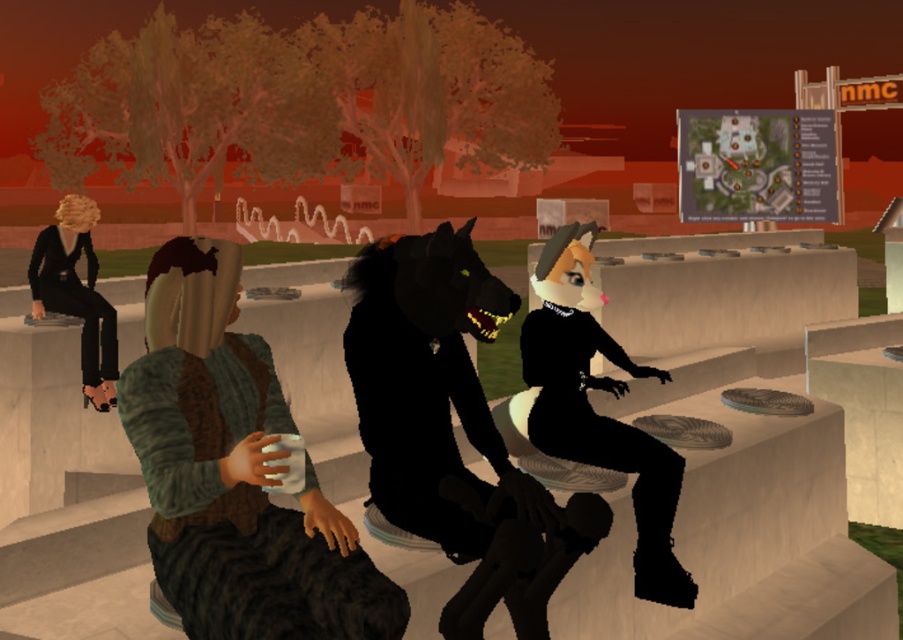
Is point (424, 244) closer to viewer compared to point (585, 321)?

Yes, it is.

Image resolution: width=903 pixels, height=640 pixels. In order to click on black matte wolf at center in this screenshot , I will do `click(430, 385)`.

Measure the distance between knitted sweater at center and camera.

The distance of knitted sweater at center from camera is 8.93 feet.

Between knitted sweater at center and black matte cat at center, which one appears on the right side from the viewer's perspective?

Positioned to the right is black matte cat at center.

Identify the location of knitted sweater at center. (235, 474).

Can you confirm if shiny black fur at center is taller than black matte pants at left?

No.

Looking at this image, between shiny black fur at center and black matte pants at left, which one appears on the right side from the viewer's perspective?

From the viewer's perspective, shiny black fur at center appears more on the right side.

You are a GUI agent. You are given a task and a screenshot of the screen. Output one action in this format:
    pyautogui.click(x=<x>, y=<y>)
    Task: Click on the shiny black fur at center
    
    Given the screenshot: What is the action you would take?
    pyautogui.click(x=519, y=552)

This screenshot has height=640, width=903. I want to click on shiny black fur at center, so click(x=519, y=552).